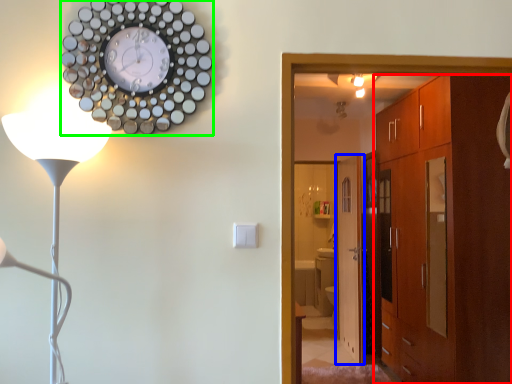
Question: Which is farther away from cabinetry (highlighted by a red box)? door (highlighted by a blue box) or wall clock (highlighted by a green box)?

Choices:
 (A) door
 (B) wall clock

Answer: (B)